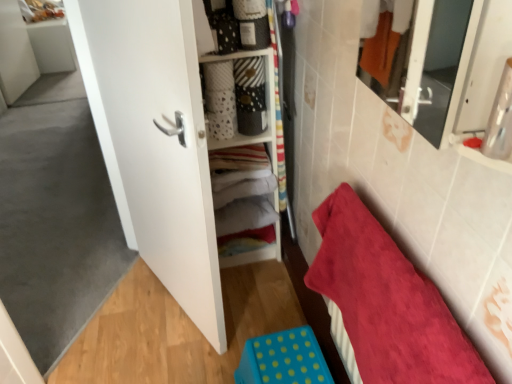
Locate an element on the screen. The height and width of the screenshot is (384, 512). empty space that is ontop of blue polka dot plastic step stool at lower center (from a real-world perspective) is located at coordinates (284, 355).